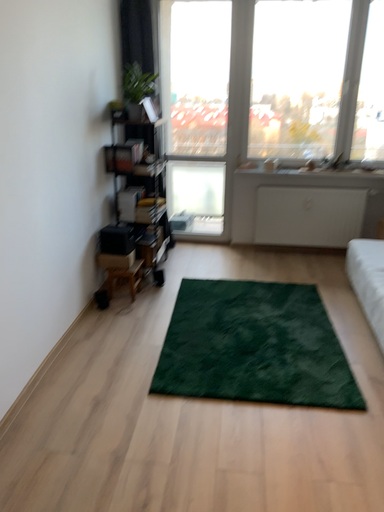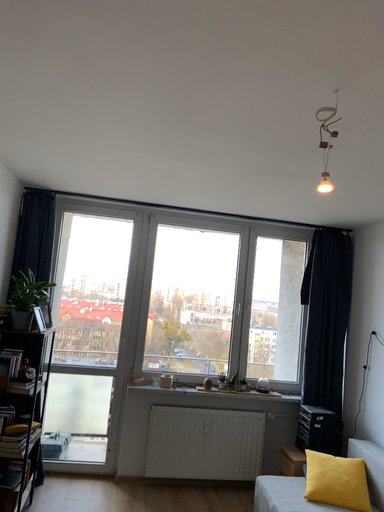
Question: Which way did the camera rotate in the video?

Choices:
 (A) rotated right
 (B) rotated left

Answer: (A)